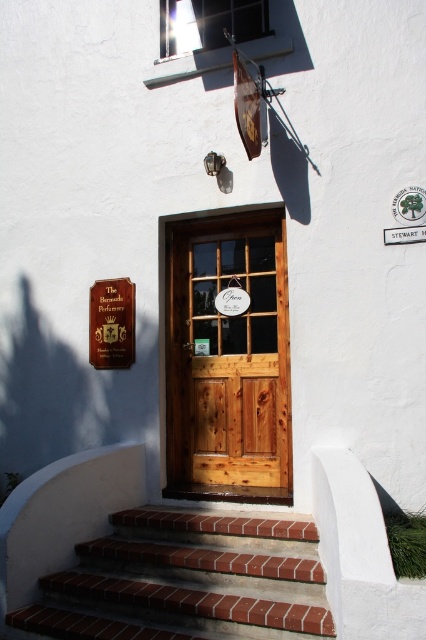
Question: Estimate the real-world distances between objects in this image. Which object is farther from the wooden door at center?

Choices:
 (A) gold metallic sign at upper center
 (B) brick/stamped concrete stairs at lower center

Answer: (B)

Question: Can you confirm if wooden door at center is positioned above brick/stamped concrete stairs at lower center?

Choices:
 (A) no
 (B) yes

Answer: (B)

Question: Can you confirm if brick/stamped concrete stairs at lower center is positioned below gold metallic sign at upper center?

Choices:
 (A) no
 (B) yes

Answer: (B)

Question: Which point is closer to the camera taking this photo?

Choices:
 (A) (311, 557)
 (B) (117, 308)
 (C) (169, 394)

Answer: (A)

Question: Which point is farther to the camera?

Choices:
 (A) (103, 296)
 (B) (158, 540)

Answer: (A)

Question: Is wooden door at center thinner than gold metallic sign at upper center?

Choices:
 (A) no
 (B) yes

Answer: (A)